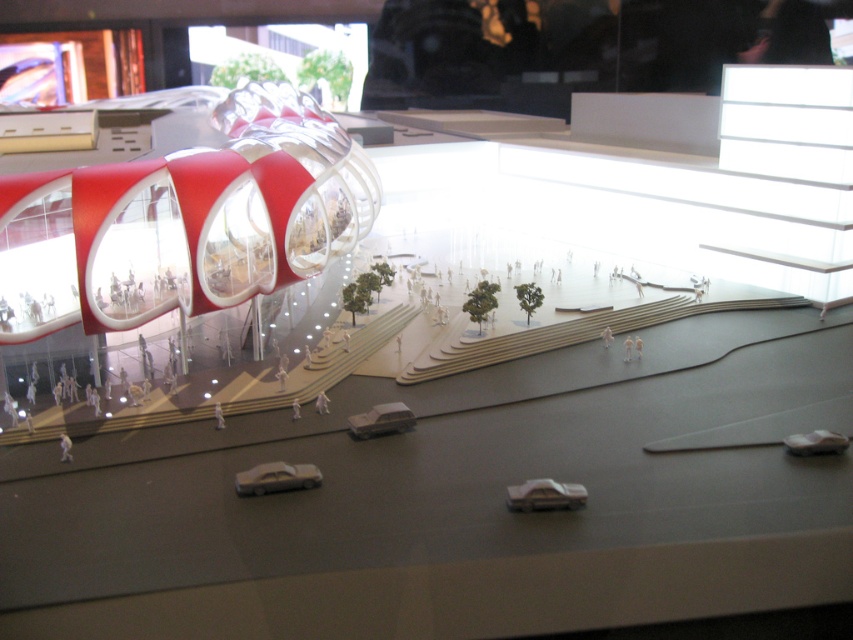
You are a toy collector who wants to display both the white glossy toy car at lower center and the white matte toy car at center on a shelf. The shelf has a width limit of 10 cm. If the combined width of both cars is 12 cm, will they fit together on the shelf?

The white glossy toy car at lower center is larger in width than the white matte toy car at center. Since their combined width is 12 cm, which exceeds the shelf width limit of 10 cm, they cannot fit together on the shelf.

You are a visitor at the architectural model exhibition and want to take a photo of the metallic silver car at center without the white matte toy car at lower right appearing in the frame. Can you move your camera position to achieve this?

Yes, because the metallic silver car at center is closer to the viewer than the white matte toy car at lower right, you can move your camera position to focus on the metallic silver car at center while positioning the white matte toy car at lower right out of the frame by adjusting the angle or distance.